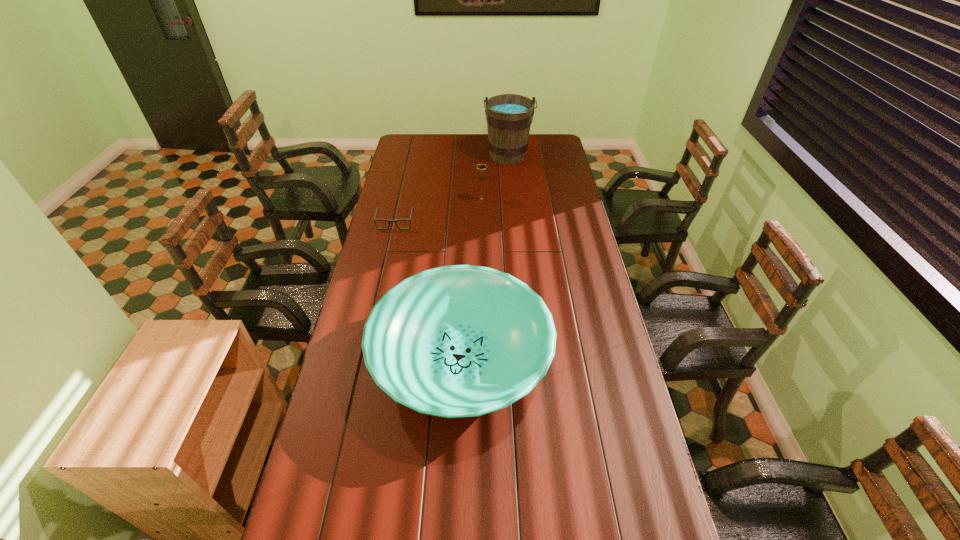
You are a GUI agent. You are given a task and a screenshot of the screen. Output one action in this format:
    pyautogui.click(x=<x>, y=<y>)
    Task: Click on the free region located on the front of the nearest object
    This screenshot has width=960, height=540.
    Given the screenshot: What is the action you would take?
    [456, 475]

Find the location of a particular element. vacant area located 0.090m on the lens of the shortest object is located at coordinates (391, 243).

Where is `object that is positioned at the far edge`? The image size is (960, 540). object that is positioned at the far edge is located at coordinates (509, 117).

Where is `dish positioned at the left edge`? This screenshot has width=960, height=540. dish positioned at the left edge is located at coordinates (455, 341).

At what (x,y) coordinates should I click in order to perform the action: click on spectacles that is at the left edge. Please return your answer as a coordinate pair (x, y). The image size is (960, 540). Looking at the image, I should click on (389, 221).

Identify the location of free region at the far edge of the desktop. (451, 145).

Locate an element on the screen. Image resolution: width=960 pixels, height=540 pixels. vacant area at the left edge of the desktop is located at coordinates (326, 422).

This screenshot has height=540, width=960. What are the coordinates of `free space at the right edge of the desktop` in the screenshot? It's located at (548, 166).

The image size is (960, 540). Identify the location of blank space at the far right corner of the desktop. (558, 148).

You are a GUI agent. You are given a task and a screenshot of the screen. Output one action in this format:
    pyautogui.click(x=<x>, y=<y>)
    Task: Click on the vacant area that lies between the wine bucket and the third shortest object
    The image size is (960, 540).
    Given the screenshot: What is the action you would take?
    pos(494,178)